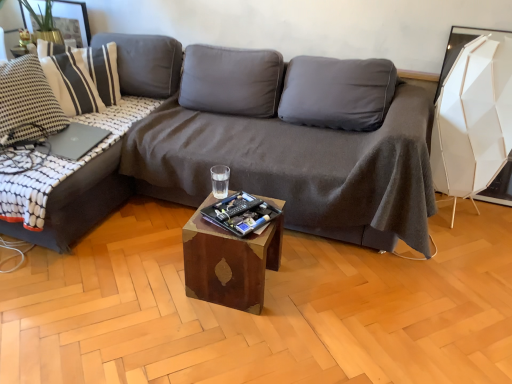
I want to click on free space above wooden cube at center (from a real-world perspective), so click(x=237, y=217).